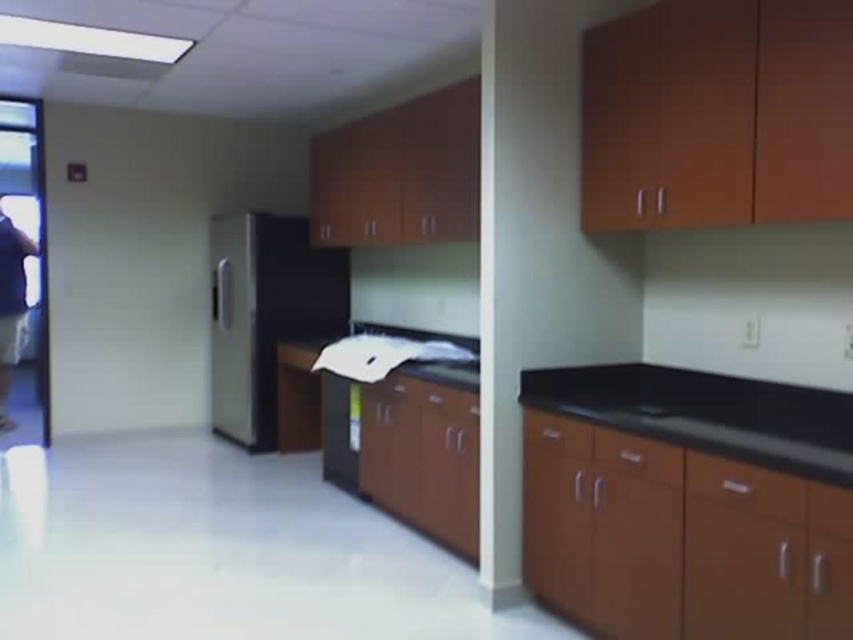
Which is more to the left, satin black refrigerator at center or dark blue shirt at left?

dark blue shirt at left

Which is more to the right, satin black refrigerator at center or dark blue shirt at left?

satin black refrigerator at center

In order to click on satin black refrigerator at center in this screenshot , I will do `click(265, 314)`.

Is black granite countertop at center closer to camera compared to dark blue shirt at left?

Yes, black granite countertop at center is closer to the viewer.

Between point (573, 387) and point (13, 248), which one is positioned behind?

Positioned behind is point (13, 248).

Who is more distant from viewer, (x=683, y=433) or (x=19, y=237)?

The point (x=19, y=237) is more distant.

Locate an element on the screen. black granite countertop at center is located at coordinates click(706, 413).

Locate an element on the screen. The image size is (853, 640). black granite countertop at center is located at coordinates (706, 413).

Is point (642, 396) in front of point (277, 321)?

That is True.

Image resolution: width=853 pixels, height=640 pixels. I want to click on black granite countertop at center, so click(x=706, y=413).